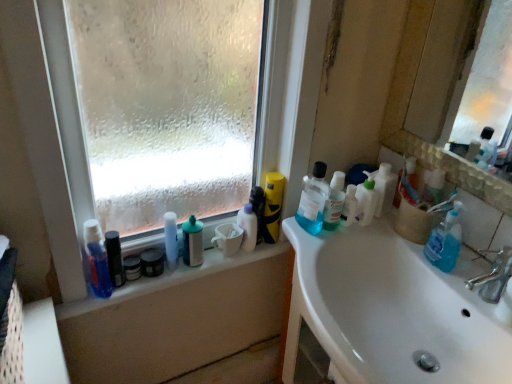
Question: From the image's perspective, is white glossy bottle at center, placed as the sixth toiletry when sorted from right to left, below silver metallic faucet at sink right?

Choices:
 (A) yes
 (B) no

Answer: (B)

Question: Is white glossy bottle at center, placed as the sixth toiletry when sorted from right to left, shorter than silver metallic faucet at sink right?

Choices:
 (A) no
 (B) yes

Answer: (A)

Question: Does white glossy bottle at center, which is the 3th toiletry in left-to-right order, have a larger size compared to silver metallic faucet at sink right?

Choices:
 (A) yes
 (B) no

Answer: (B)

Question: Is white glossy bottle at center, placed as the sixth toiletry when sorted from right to left, wider than silver metallic faucet at sink right?

Choices:
 (A) no
 (B) yes

Answer: (A)

Question: Is white glossy bottle at center, which is the 3th toiletry in left-to-right order, next to silver metallic faucet at sink right and touching it?

Choices:
 (A) yes
 (B) no

Answer: (B)

Question: From a real-world perspective, is clear plastic window sill at upper left positioned above or below white pump bottle at upper right, acting as the 2th cleaning product starting from the right?

Choices:
 (A) below
 (B) above

Answer: (A)

Question: Do you think clear plastic window sill at upper left is within white pump bottle at upper right, acting as the 2th cleaning product starting from the right, or outside of it?

Choices:
 (A) inside
 (B) outside

Answer: (B)

Question: Based on their sizes in the image, would you say clear plastic window sill at upper left is bigger or smaller than white pump bottle at upper right, acting as the 2th cleaning product starting from the right?

Choices:
 (A) small
 (B) big

Answer: (B)

Question: Is clear plastic window sill at upper left wider or thinner than white pump bottle at upper right, which is the second cleaning product from left to right?

Choices:
 (A) thin
 (B) wide

Answer: (B)

Question: Is point (290, 198) positioned closer to the camera than point (360, 208)?

Choices:
 (A) closer
 (B) farther

Answer: (B)

Question: From a real-world perspective, is frosted glass window at upper left positioned above or below white pump bottle at upper right, acting as the 2th cleaning product starting from the right?

Choices:
 (A) below
 (B) above

Answer: (B)

Question: Considering their positions, is frosted glass window at upper left located in front of or behind white pump bottle at upper right, which is the second cleaning product from left to right?

Choices:
 (A) behind
 (B) front

Answer: (B)

Question: Considering the positions of frosted glass window at upper left and white pump bottle at upper right, acting as the 2th cleaning product starting from the right, in the image, is frosted glass window at upper left taller or shorter than white pump bottle at upper right, acting as the 2th cleaning product starting from the right,?

Choices:
 (A) tall
 (B) short

Answer: (A)

Question: Which is correct: matte black jar at window sill, which appears as the 2th toiletry when viewed from the left, is inside white plastic bottle at upper right, the first cleaning product from the right, or outside of it?

Choices:
 (A) inside
 (B) outside

Answer: (B)

Question: Considering their positions, is matte black jar at window sill, the seventh toiletry viewed from the right, located in front of or behind white plastic bottle at upper right, the first cleaning product from the right?

Choices:
 (A) behind
 (B) front

Answer: (B)